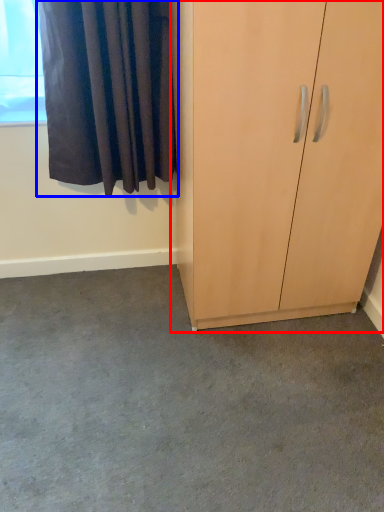
Question: Which point is further to the camera, cupboard (highlighted by a red box) or curtain (highlighted by a blue box)?

Choices:
 (A) cupboard
 (B) curtain

Answer: (B)